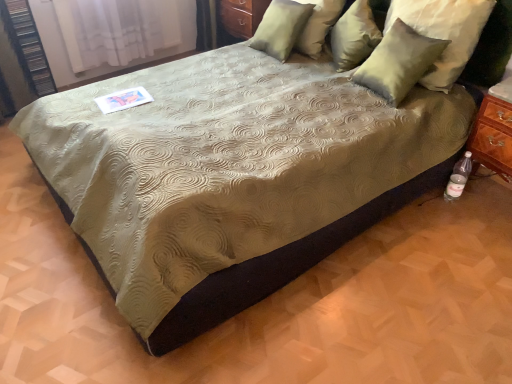
Question: In terms of height, does matte wood dresser at upper center look taller or shorter compared to satin green pillow at upper right, the fourth pillow from the left?

Choices:
 (A) tall
 (B) short

Answer: (B)

Question: Relative to satin green pillow at upper right, the fourth pillow from the left, is matte wood dresser at upper center in front or behind?

Choices:
 (A) front
 (B) behind

Answer: (B)

Question: Considering the real-world distances, which object is closest to the white sheer curtain at upper left?

Choices:
 (A) satin green pillow at upper right, the fourth pillow from the left
 (B) satin green pillow at upper right, acting as the 4th pillow starting from the right
 (C) clear plastic bottle at lower right
 (D) matte wood dresser at upper center
 (E) satin green pillow at upper right, the third pillow viewed from the left

Answer: (D)

Question: Which object is positioned closest to the matte wood dresser at upper center?

Choices:
 (A) satin green pillow at upper right, acting as the first pillow starting from the left
 (B) satin green pillow at upper right, the third pillow viewed from the left
 (C) satin green pillow at upper right, the fourth pillow from the left
 (D) clear plastic bottle at lower right
 (E) suede-like beige pillow at upper right, positioned as the 3th pillow in right-to-left order

Answer: (A)